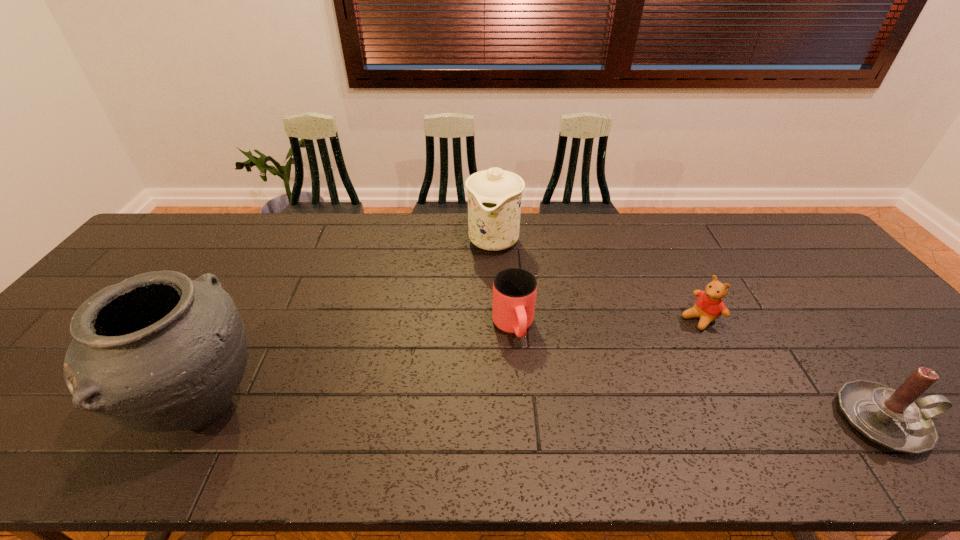
At what (x,y) coordinates should I click in order to perform the action: click on vacant space that satisfies the following two spatial constraints: 1. on the back side of the second object from right to left; 2. on the right side of the cup. Please return your answer as a coordinate pair (x, y). Looking at the image, I should click on (513, 318).